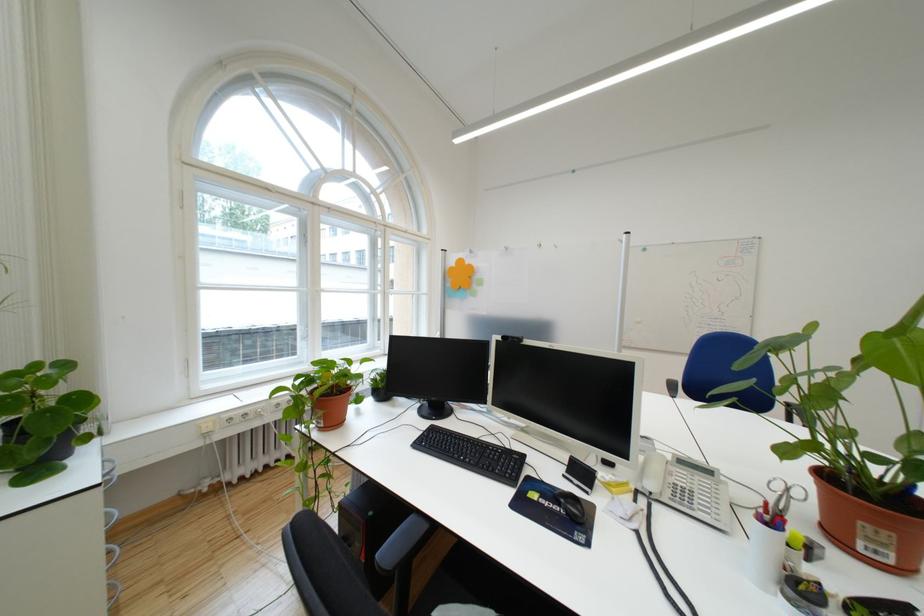
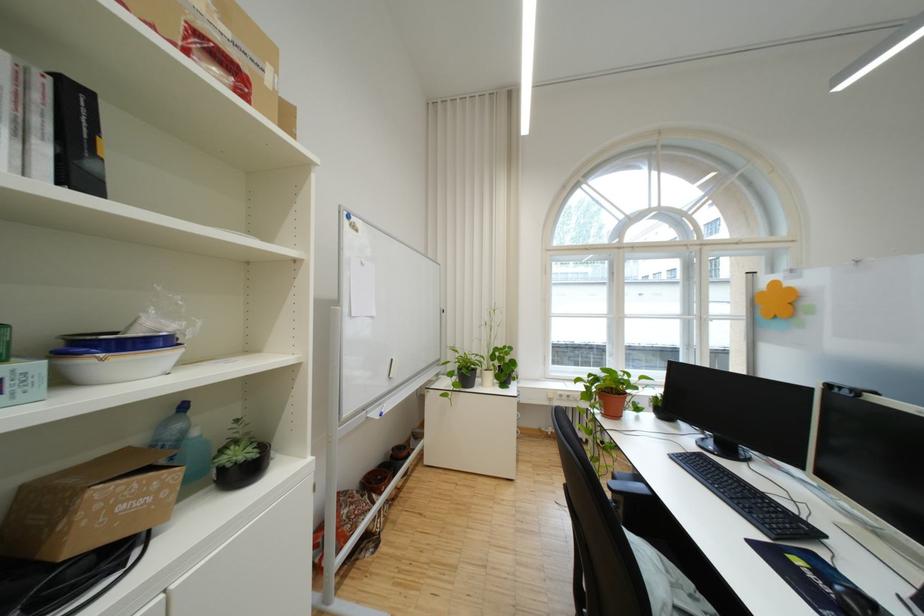
Where in the second image is the point corresponding to [196,206] from the first image?

(558, 273)